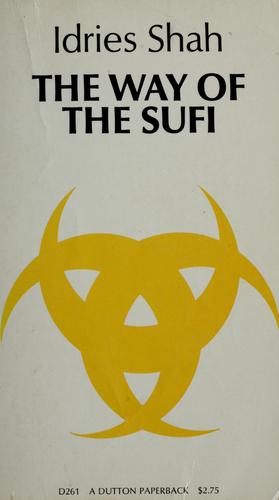
I want to click on book, so click(x=238, y=384).